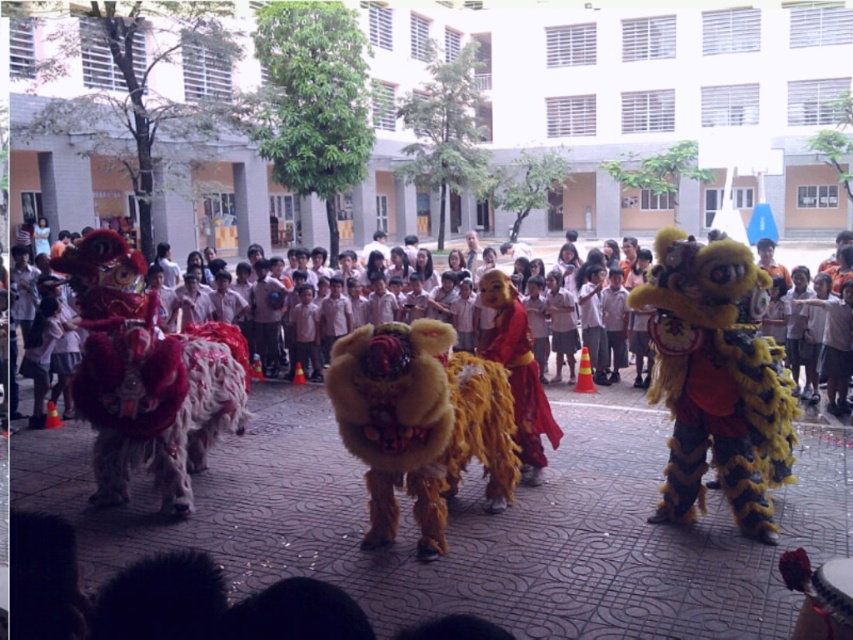
You are a photographer trying to capture the tallest lion in the scene. You see the yellow furry lion at right and the fuzzy yellow lion at center. Which one should you focus on to get the tallest lion?

The yellow furry lion at right is taller than the fuzzy yellow lion at center, so you should focus on the yellow furry lion at right to capture the tallest lion.

You are a photographer standing in the courtyard and want to capture a photo of the shiny red lion at left and the fuzzy yellow lion at center. Which lion should you focus on first if you want to include both in your frame without moving the camera?

The shiny red lion at left is located above the fuzzy yellow lion at center, so you should focus on the fuzzy yellow lion at center first to ensure both are in the frame.

You are a photographer trying to capture the lion dance performance. You want to ensure both the yellow furry lion at right and the shiny red lion at left are in frame. Given their sizes, which lion should you focus on to ensure both fit comfortably in the photo?

The yellow furry lion at right is smaller than the shiny red lion at left. To ensure both fit comfortably in the photo, focus on the shiny red lion at left since it takes up more space, allowing the smaller yellow furry lion at right to be included without overcrowding.